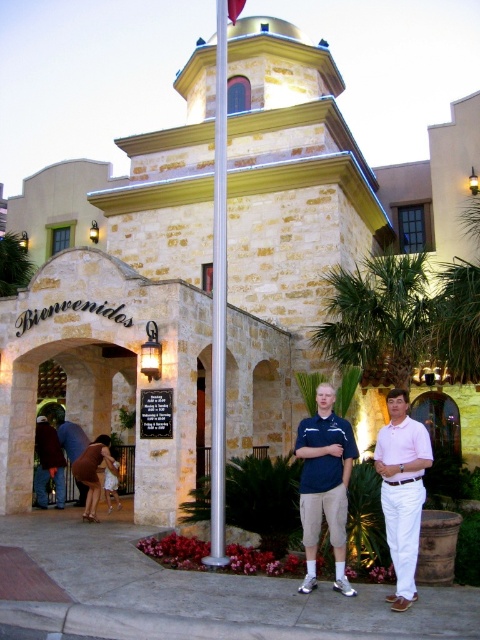
Question: Which point is farther to the camera?

Choices:
 (A) silver metallic flag pole at center
 (B) brown leather dress at lower left
 (C) brown fabric dress at lower left

Answer: (B)

Question: Can you confirm if dark blue shirt at center is positioned to the left of brown leather jacket at lower left?

Choices:
 (A) no
 (B) yes

Answer: (A)

Question: Which of the following is the farthest from the observer?

Choices:
 (A) blue cotton shirt at center
 (B) pink cotton shirt at center
 (C) green leafy palm tree at center-right

Answer: (C)

Question: Does blue cotton shirt at center appear on the right side of brown fabric dress at lower left?

Choices:
 (A) no
 (B) yes

Answer: (B)

Question: Does silver metallic flag pole at center have a larger size compared to brown fabric dress at lower left?

Choices:
 (A) no
 (B) yes

Answer: (B)

Question: Which point appears farthest from the camera in this image?

Choices:
 (A) (396, 307)
 (B) (67, 429)

Answer: (B)